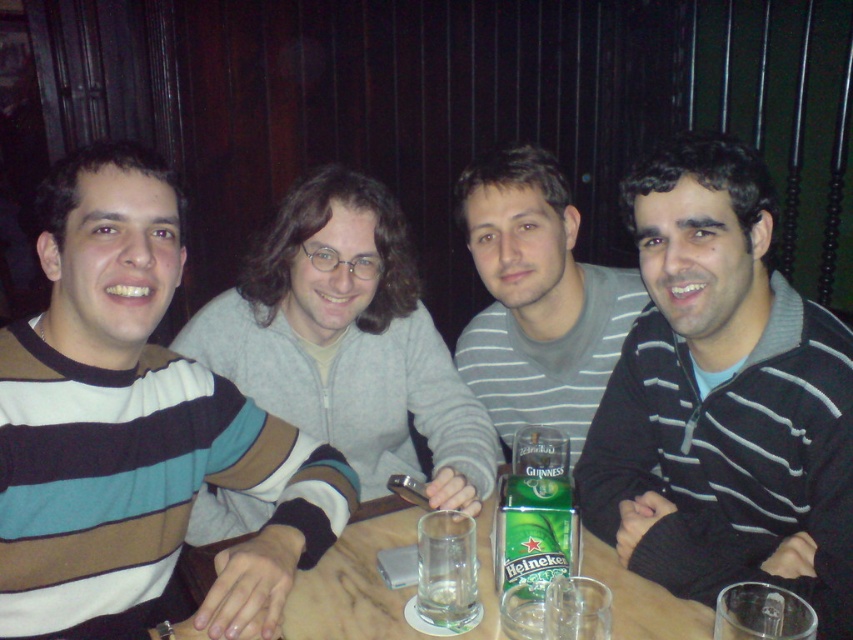
From the picture: Does black striped sweater at center have a lesser width compared to clear glass at table center?

No.

Is point (795, 580) farther from camera compared to point (444, 600)?

Yes, point (795, 580) is behind point (444, 600).

This screenshot has width=853, height=640. I want to click on black striped sweater at center, so click(723, 397).

Does black striped sweater at center lie in front of wooden table at center?

That is True.

Does black striped sweater at center have a greater height compared to wooden table at center?

Indeed, black striped sweater at center has a greater height compared to wooden table at center.

Who is more distant from viewer, (691, 186) or (396, 545)?

Point (396, 545)

Find the location of `black striped sweater at center`. black striped sweater at center is located at coordinates (723, 397).

Between striped cotton sweater at left and gray zip-up sweater at center, which one appears on the right side from the viewer's perspective?

Positioned to the right is gray zip-up sweater at center.

Can you confirm if striped cotton sweater at left is taller than gray zip-up sweater at center?

Incorrect, striped cotton sweater at left's height is not larger of gray zip-up sweater at center's.

Where is `striped cotton sweater at left`? striped cotton sweater at left is located at coordinates (135, 429).

This screenshot has width=853, height=640. Identify the location of striped cotton sweater at left. (135, 429).